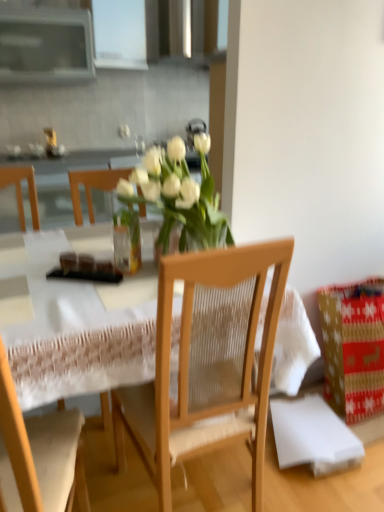
Locate an element on the screen. The width and height of the screenshot is (384, 512). vacant space situated on the left part of transparent glass vase at center is located at coordinates (x=79, y=268).